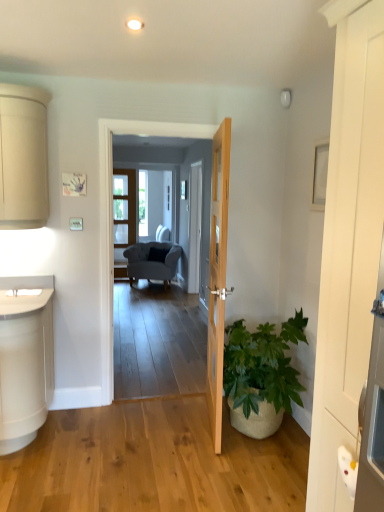
Find the location of a particular element. Image resolution: width=384 pixels, height=512 pixels. free location to the left of green leafy plant in woven basket at lower right is located at coordinates (165, 434).